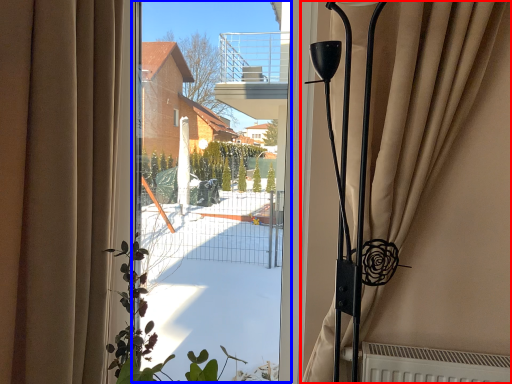
Question: Which object is further to the camera taking this photo, curtain (highlighted by a red box) or window screen (highlighted by a blue box)?

Choices:
 (A) curtain
 (B) window screen

Answer: (B)